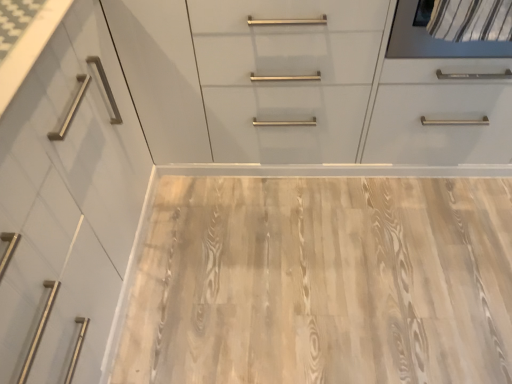
What do you see at coordinates (322, 282) in the screenshot? The height and width of the screenshot is (384, 512). I see `light wood/texture plywood at center` at bounding box center [322, 282].

In order to click on light wood/texture plywood at center in this screenshot , I will do `click(322, 282)`.

Looking at this image, in order to face light wood/texture plywood at center, should I rotate leftwards or rightwards?

It's best to rotate right around 11.890 degrees.

The image size is (512, 384). What are the coordinates of `white glossy cabinet at upper center` in the screenshot? It's located at (301, 86).

What do you see at coordinates (301, 86) in the screenshot? I see `white glossy cabinet at upper center` at bounding box center [301, 86].

In order to face white glossy cabinet at upper center, should I rotate leftwards or rightwards?

To face it directly, rotate left by 9.234 degrees.

Locate an element on the screen. Image resolution: width=512 pixels, height=384 pixels. light wood/texture plywood at center is located at coordinates (322, 282).

Can you confirm if white glossy cabinet at upper center is positioned to the right of light wood/texture plywood at center?

No, white glossy cabinet at upper center is not to the right of light wood/texture plywood at center.

Which object is closer to the camera, white glossy cabinet at upper center or light wood/texture plywood at center?

white glossy cabinet at upper center.

Considering the positions of point (293, 90) and point (460, 379), is point (293, 90) closer or farther from the camera than point (460, 379)?

Clearly, point (293, 90) is more distant from the camera than point (460, 379).

From the image's perspective, which is above, white glossy cabinet at upper center or light wood/texture plywood at center?

From the image's view, white glossy cabinet at upper center is above.

From a real-world perspective, who is located lower, white glossy cabinet at upper center or light wood/texture plywood at center?

light wood/texture plywood at center.

Looking at their sizes, would you say white glossy cabinet at upper center is wider or thinner than light wood/texture plywood at center?

In the image, white glossy cabinet at upper center appears to be more narrow than light wood/texture plywood at center.

Considering the relative sizes of white glossy cabinet at upper center and light wood/texture plywood at center in the image provided, is white glossy cabinet at upper center taller than light wood/texture plywood at center?

Indeed, white glossy cabinet at upper center has a greater height compared to light wood/texture plywood at center.

Is white glossy cabinet at upper center smaller than light wood/texture plywood at center?

Actually, white glossy cabinet at upper center might be larger than light wood/texture plywood at center.

Is light wood/texture plywood at center completely or partially inside white glossy cabinet at upper center?

Actually, light wood/texture plywood at center is outside white glossy cabinet at upper center.

Would you say white glossy cabinet at upper center is a long distance from light wood/texture plywood at center?

white glossy cabinet at upper center is actually quite close to light wood/texture plywood at center.

Is light wood/texture plywood at center at the back of white glossy cabinet at upper center?

No.

How many degrees apart are the facing directions of white glossy cabinet at upper center and light wood/texture plywood at center?

180 degrees separate the facing orientations of white glossy cabinet at upper center and light wood/texture plywood at center.

You are a GUI agent. You are given a task and a screenshot of the screen. Output one action in this format:
    pyautogui.click(x=<x>, y=<y>)
    Task: Click on the dresser that is above the light wood/texture plywood at center (from a real-world perspective)
    
    Given the screenshot: What is the action you would take?
    pyautogui.click(x=301, y=86)

Is light wood/texture plywood at center to the left of white glossy cabinet at upper center from the viewer's perspective?

In fact, light wood/texture plywood at center is to the right of white glossy cabinet at upper center.

Considering the positions of objects light wood/texture plywood at center and white glossy cabinet at upper center in the image provided, who is in front, light wood/texture plywood at center or white glossy cabinet at upper center?

white glossy cabinet at upper center is in front.

Between point (222, 308) and point (256, 19), which one is positioned behind?

Point (222, 308)

Consider the image. From the image's perspective, which is above, light wood/texture plywood at center or white glossy cabinet at upper center?

white glossy cabinet at upper center, from the image's perspective.

From a real-world perspective, who is located higher, light wood/texture plywood at center or white glossy cabinet at upper center?

In real-world perspective, white glossy cabinet at upper center is above.

Considering the relative sizes of light wood/texture plywood at center and white glossy cabinet at upper center in the image provided, is light wood/texture plywood at center thinner than white glossy cabinet at upper center?

Incorrect, the width of light wood/texture plywood at center is not less than that of white glossy cabinet at upper center.

Who is taller, light wood/texture plywood at center or white glossy cabinet at upper center?

Standing taller between the two is white glossy cabinet at upper center.

Is light wood/texture plywood at center bigger or smaller than white glossy cabinet at upper center?

Clearly, light wood/texture plywood at center is smaller in size than white glossy cabinet at upper center.

Is light wood/texture plywood at center inside or outside of white glossy cabinet at upper center?

light wood/texture plywood at center cannot be found inside white glossy cabinet at upper center.

Is light wood/texture plywood at center with white glossy cabinet at upper center?

No, light wood/texture plywood at center is not in contact with white glossy cabinet at upper center.

Is light wood/texture plywood at center oriented away from white glossy cabinet at upper center?

No, light wood/texture plywood at center is not facing away from white glossy cabinet at upper center.

What's the angular difference between light wood/texture plywood at center and white glossy cabinet at upper center's facing directions?

180 degrees separate the facing orientations of light wood/texture plywood at center and white glossy cabinet at upper center.

This screenshot has height=384, width=512. I want to click on plywood behind the white glossy cabinet at upper center, so click(x=322, y=282).

This screenshot has width=512, height=384. In order to click on dresser located in front of the light wood/texture plywood at center in this screenshot , I will do `click(301, 86)`.

Where is `dresser above the light wood/texture plywood at center (from the image's perspective)`? dresser above the light wood/texture plywood at center (from the image's perspective) is located at coordinates (301, 86).